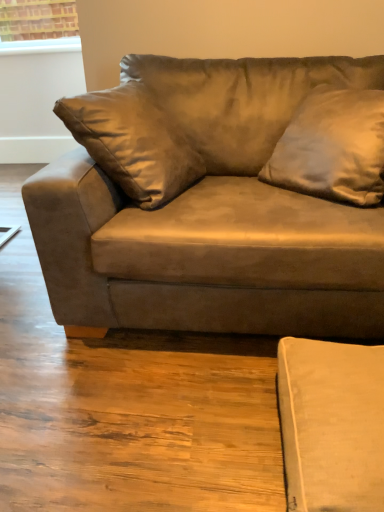
Question: Is suede-like brown couch at center surrounding satin brown pillow at upper right?

Choices:
 (A) yes
 (B) no

Answer: (A)

Question: Does suede-like brown couch at center come in front of satin brown pillow at upper right?

Choices:
 (A) yes
 (B) no

Answer: (A)

Question: Is suede-like brown couch at center in contact with satin brown pillow at upper right?

Choices:
 (A) no
 (B) yes

Answer: (A)

Question: Does suede-like brown couch at center have a smaller size compared to satin brown pillow at upper right?

Choices:
 (A) no
 (B) yes

Answer: (A)

Question: Is suede-like brown couch at center positioned beyond the bounds of satin brown pillow at upper right?

Choices:
 (A) yes
 (B) no

Answer: (A)

Question: From a real-world perspective, is suede-like brown couch at center located beneath satin brown pillow at upper right?

Choices:
 (A) yes
 (B) no

Answer: (A)

Question: From a real-world perspective, is satin brown pillow at upper right positioned under suede-like brown couch at center based on gravity?

Choices:
 (A) no
 (B) yes

Answer: (A)

Question: From a real-world perspective, is satin brown pillow at upper right located higher than suede-like brown couch at center?

Choices:
 (A) yes
 (B) no

Answer: (A)

Question: Would you say satin brown pillow at upper right is outside suede-like brown couch at center?

Choices:
 (A) no
 (B) yes

Answer: (A)

Question: Can you confirm if satin brown pillow at upper right is thinner than suede-like brown couch at center?

Choices:
 (A) no
 (B) yes

Answer: (B)

Question: Is satin brown pillow at upper right bigger than suede-like brown couch at center?

Choices:
 (A) yes
 (B) no

Answer: (B)

Question: Is satin brown pillow at upper right with suede-like brown couch at center?

Choices:
 (A) no
 (B) yes

Answer: (A)

Question: Is point (291, 297) positioned closer to the camera than point (327, 135)?

Choices:
 (A) farther
 (B) closer

Answer: (B)